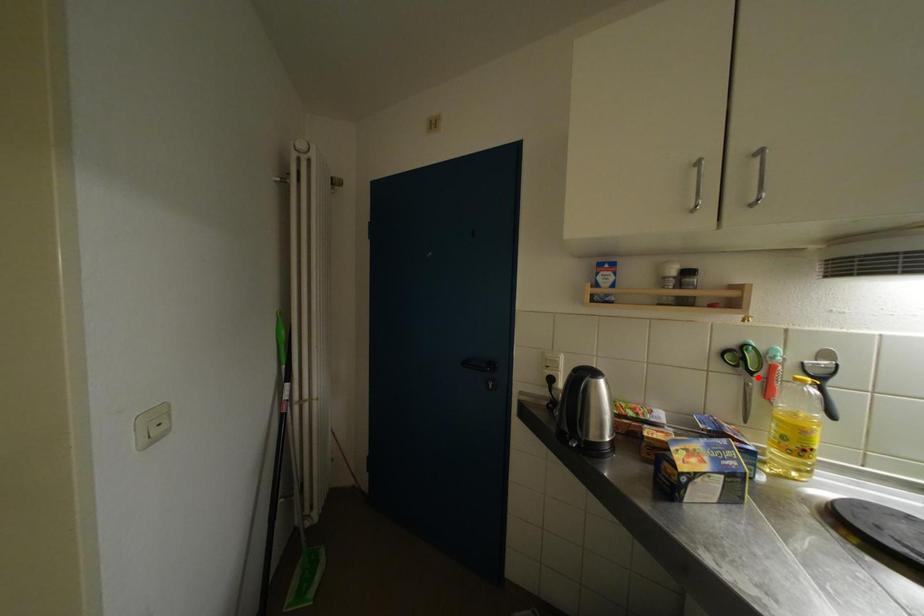
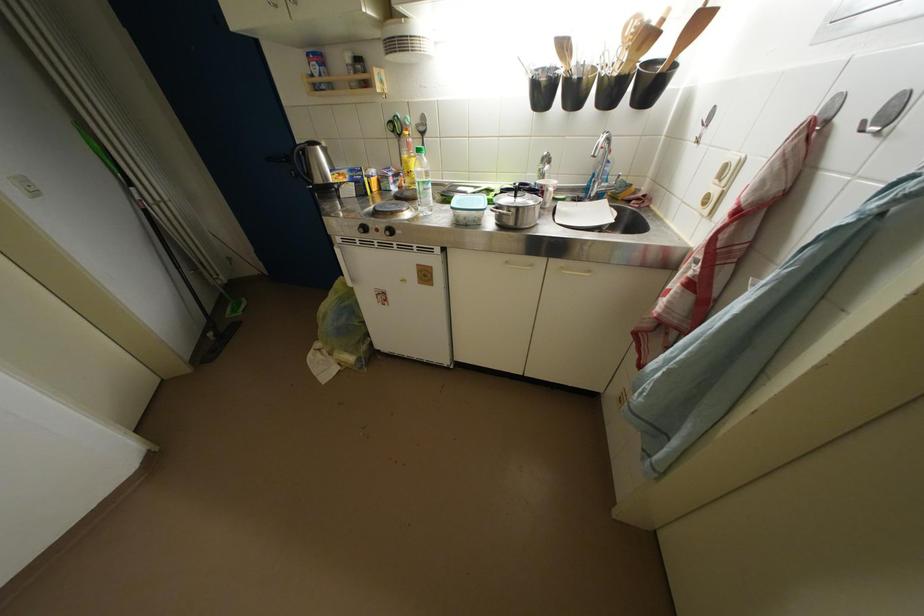
Locate, in the second image, the point that corresponds to the highlighted location in the first image.

(407, 140)